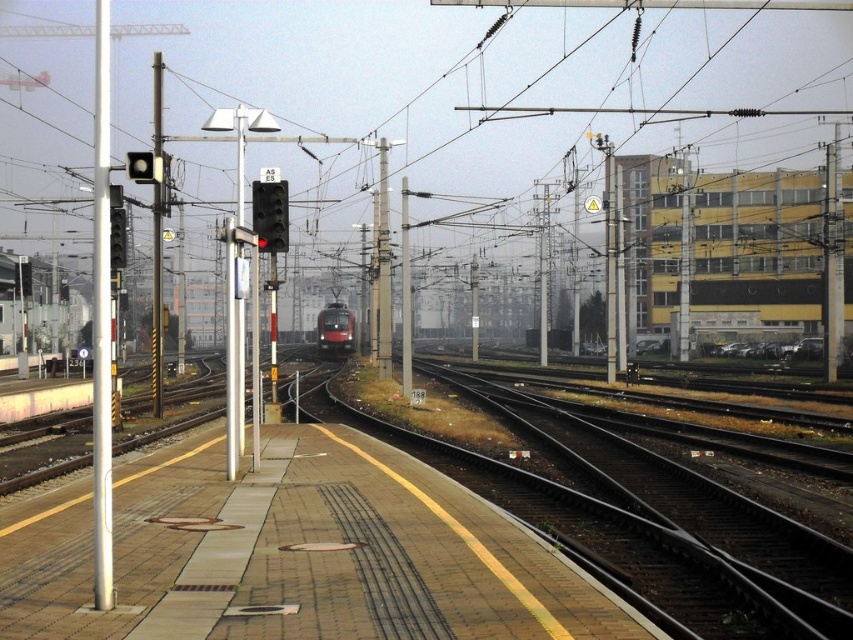
Question: Is brick platform at center bigger than metallic pole at left?

Choices:
 (A) yes
 (B) no

Answer: (B)

Question: Which object is the closest to the white metallic pole at left?

Choices:
 (A) metallic pole at center
 (B) brick platform at center

Answer: (B)

Question: Can you confirm if metallic pole at left is bigger than metallic pole at center?

Choices:
 (A) no
 (B) yes

Answer: (B)

Question: Can you confirm if brick platform at center is positioned to the right of white metallic pole at left?

Choices:
 (A) no
 (B) yes

Answer: (B)

Question: Estimate the real-world distances between objects in this image. Which object is farther from the brick platform at center?

Choices:
 (A) red glossy train at center
 (B) metallic pole at center
 (C) white metallic pole at left
 (D) metallic pole at left

Answer: (A)

Question: Which of the following is the closest to the observer?

Choices:
 (A) metallic pole at left
 (B) brick platform at center
 (C) white metallic pole at left

Answer: (B)